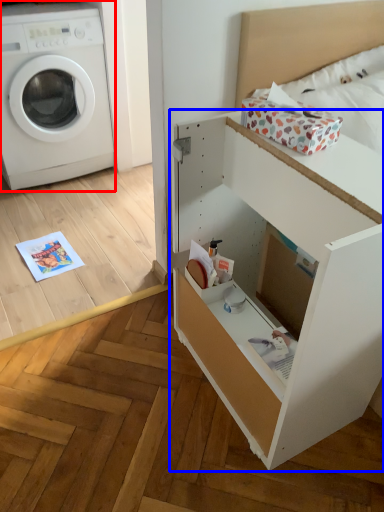
Question: Which of the following is the closest to the observer, washing machine (highlighted by a red box) or file cabinet (highlighted by a blue box)?

Choices:
 (A) washing machine
 (B) file cabinet

Answer: (B)